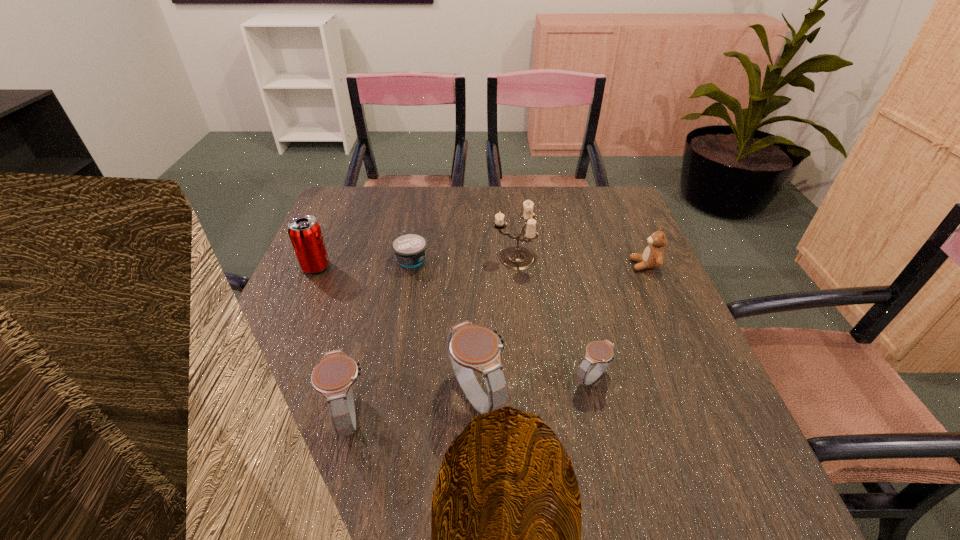
Image resolution: width=960 pixels, height=540 pixels. I want to click on vacant region at the far edge of the desktop, so click(x=521, y=204).

Where is `vacant space at the near edge`? vacant space at the near edge is located at coordinates (545, 421).

Locate an element on the screen. Image resolution: width=960 pixels, height=540 pixels. vacant space at the left edge of the desktop is located at coordinates (282, 371).

Image resolution: width=960 pixels, height=540 pixels. Identify the location of free location at the right edge of the desktop. (611, 258).

Locate an element on the screen. vacant space at the far left corner is located at coordinates (377, 188).

The height and width of the screenshot is (540, 960). I want to click on blank space at the near left corner, so click(x=232, y=435).

Find the location of a particular element. This screenshot has width=960, height=540. vacant region between the yogurt and the second watch from right to left is located at coordinates (444, 328).

The image size is (960, 540). I want to click on vacant space that's between the second watch from left to right and the rightmost object, so (x=561, y=331).

Find the location of a particular element. vacant area that lies between the shortest object and the candle holder is located at coordinates 463,258.

I want to click on free space between the second watch from right to left and the rightmost object, so click(x=561, y=331).